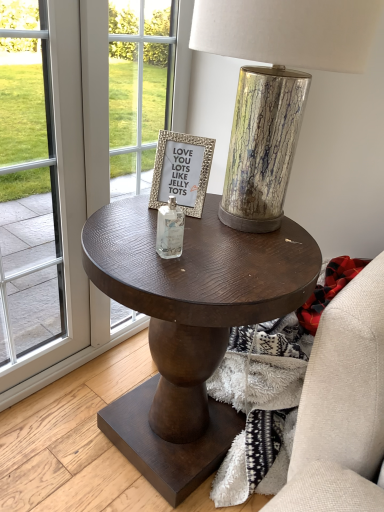
Identify the location of vacant space behind clear glass bottle at center. This screenshot has height=512, width=384. (154, 221).